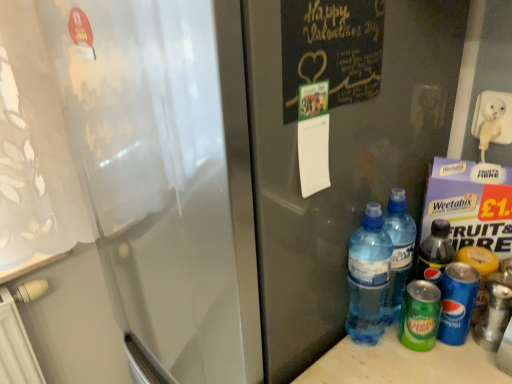
Where is `blue plastic bottle at lower right, which is counted as the 3th bottle, starting from the left`? The height and width of the screenshot is (384, 512). blue plastic bottle at lower right, which is counted as the 3th bottle, starting from the left is located at coordinates (457, 302).

Locate an element on the screen. The image size is (512, 384). black chalkboard at upper right is located at coordinates (331, 50).

This screenshot has width=512, height=384. I want to click on green matte can at lower right, the second bottle in the left-to-right sequence, so click(x=420, y=315).

Find the location of a particular element. The image size is (512, 384). blue plastic bottle at lower right, placed as the 1th bottle when sorted from right to left is located at coordinates (457, 302).

Based on the photo, which of these two, black chalkboard at upper right or green matte can at lower right, the 2th bottle in the right-to-left sequence, stands shorter?

green matte can at lower right, the 2th bottle in the right-to-left sequence, is shorter.

Considering the relative sizes of black chalkboard at upper right and green matte can at lower right, the 2th bottle in the right-to-left sequence, in the image provided, is black chalkboard at upper right smaller than green matte can at lower right, the 2th bottle in the right-to-left sequence,?

Yes, black chalkboard at upper right is smaller than green matte can at lower right, the 2th bottle in the right-to-left sequence.

Considering the positions of point (350, 84) and point (413, 281), is point (350, 84) closer or farther from the camera than point (413, 281)?

Point (350, 84).

Do you think black chalkboard at upper right is within green matte can at lower right, the second bottle in the left-to-right sequence, or outside of it?

black chalkboard at upper right cannot be found inside green matte can at lower right, the second bottle in the left-to-right sequence.

The height and width of the screenshot is (384, 512). Identify the location of bulletin board lying on the left of green matte can at lower right, the 2th bottle in the right-to-left sequence. (331, 50).

Is green matte can at lower right, the 2th bottle in the right-to-left sequence, further to camera compared to black chalkboard at upper right?

That is True.

Which object is thinner, green matte can at lower right, the 2th bottle in the right-to-left sequence, or black chalkboard at upper right?

black chalkboard at upper right.

From the image's perspective, between green matte can at lower right, the 2th bottle in the right-to-left sequence, and black chalkboard at upper right, who is located below?

From the image's view, green matte can at lower right, the 2th bottle in the right-to-left sequence, is below.

Is translucent plastic water bottles at lower right, the third bottle in the right-to-left sequence, to the left or to the right of green matte can at lower right, the second bottle in the left-to-right sequence, in the image?

From the image, it's evident that translucent plastic water bottles at lower right, the third bottle in the right-to-left sequence, is to the left of green matte can at lower right, the second bottle in the left-to-right sequence.

In the image, is translucent plastic water bottles at lower right, the first bottle when ordered from left to right, positioned in front of or behind green matte can at lower right, the second bottle in the left-to-right sequence?

translucent plastic water bottles at lower right, the first bottle when ordered from left to right, is positioned closer to the viewer than green matte can at lower right, the second bottle in the left-to-right sequence.

How far apart are translucent plastic water bottles at lower right, the third bottle in the right-to-left sequence, and green matte can at lower right, the 2th bottle in the right-to-left sequence?

They are 8.38 centimeters apart.

Can you tell me how much translucent plastic water bottles at lower right, the first bottle when ordered from left to right, and green matte can at lower right, the second bottle in the left-to-right sequence, differ in facing direction?

They differ by 0.00971 degrees in their facing directions.

Considering the sizes of objects black chalkboard at upper right and blue plastic bottle at lower right, placed as the 1th bottle when sorted from right to left, in the image provided, who is taller, black chalkboard at upper right or blue plastic bottle at lower right, placed as the 1th bottle when sorted from right to left,?

With more height is blue plastic bottle at lower right, placed as the 1th bottle when sorted from right to left.

Is black chalkboard at upper right further to camera compared to blue plastic bottle at lower right, placed as the 1th bottle when sorted from right to left?

No, black chalkboard at upper right is in front of blue plastic bottle at lower right, placed as the 1th bottle when sorted from right to left.

Which of these two, black chalkboard at upper right or blue plastic bottle at lower right, placed as the 1th bottle when sorted from right to left, is thinner?

With smaller width is black chalkboard at upper right.

Measure the distance from black chalkboard at upper right to blue plastic bottle at lower right, which is counted as the 3th bottle, starting from the left.

The distance of black chalkboard at upper right from blue plastic bottle at lower right, which is counted as the 3th bottle, starting from the left, is 42.32 centimeters.

From the image's perspective, does green matte can at lower right, the second bottle in the left-to-right sequence, appear higher than translucent plastic water bottles at lower right, the first bottle when ordered from left to right?

No.

Between green matte can at lower right, the 2th bottle in the right-to-left sequence, and translucent plastic water bottles at lower right, the first bottle when ordered from left to right, which one appears on the left side from the viewer's perspective?

translucent plastic water bottles at lower right, the first bottle when ordered from left to right.

Which point is more forward, (420, 338) or (375, 333)?

Positioned in front is point (420, 338).

In terms of width, does green matte can at lower right, the second bottle in the left-to-right sequence, look wider or thinner when compared to translucent plastic water bottles at lower right, the first bottle when ordered from left to right?

Considering their sizes, green matte can at lower right, the second bottle in the left-to-right sequence, looks slimmer than translucent plastic water bottles at lower right, the first bottle when ordered from left to right.

Choose the correct answer: Is green matte can at lower right, the second bottle in the left-to-right sequence, inside blue plastic bottle at lower right, which is counted as the 3th bottle, starting from the left, or outside it?

green matte can at lower right, the second bottle in the left-to-right sequence, cannot be found inside blue plastic bottle at lower right, which is counted as the 3th bottle, starting from the left.

Are green matte can at lower right, the second bottle in the left-to-right sequence, and blue plastic bottle at lower right, which is counted as the 3th bottle, starting from the left, making contact?

Indeed, green matte can at lower right, the second bottle in the left-to-right sequence, and blue plastic bottle at lower right, which is counted as the 3th bottle, starting from the left, are beside each other and touching.

Measure the distance from green matte can at lower right, the 2th bottle in the right-to-left sequence, to blue plastic bottle at lower right, placed as the 1th bottle when sorted from right to left.

3.75 centimeters.

Between green matte can at lower right, the second bottle in the left-to-right sequence, and blue plastic bottle at lower right, placed as the 1th bottle when sorted from right to left, which one is positioned behind?

green matte can at lower right, the second bottle in the left-to-right sequence.

Does point (377, 338) come farther from viewer compared to point (452, 336)?

Yes, it is behind point (452, 336).

Which object is further away from the camera, translucent plastic water bottles at lower right, the third bottle in the right-to-left sequence, or blue plastic bottle at lower right, which is counted as the 3th bottle, starting from the left?

blue plastic bottle at lower right, which is counted as the 3th bottle, starting from the left, is behind.

Is translucent plastic water bottles at lower right, the first bottle when ordered from left to right, facing away from blue plastic bottle at lower right, which is counted as the 3th bottle, starting from the left?

That's not correct — translucent plastic water bottles at lower right, the first bottle when ordered from left to right, is not looking away from blue plastic bottle at lower right, which is counted as the 3th bottle, starting from the left.

Based on the photo, between translucent plastic water bottles at lower right, the first bottle when ordered from left to right, and blue plastic bottle at lower right, placed as the 1th bottle when sorted from right to left, which one has more height?

Standing taller between the two is translucent plastic water bottles at lower right, the first bottle when ordered from left to right.

From the image's perspective, count 3rd bottles downward from the black chalkboard at upper right and point to it. Please provide its 2D coordinates.

[(420, 315)]

Which bottle is the 2nd one when counting from the right side of the black chalkboard at upper right? Please provide its 2D coordinates.

[(420, 315)]

Looking at the image, which one is located further to green matte can at lower right, the second bottle in the left-to-right sequence, black chalkboard at upper right or blue plastic bottle at lower right, which is counted as the 3th bottle, starting from the left?

Among the two, black chalkboard at upper right is located further to green matte can at lower right, the second bottle in the left-to-right sequence.

Based on the photo, from the image, which object appears to be farther from green matte can at lower right, the 2th bottle in the right-to-left sequence, blue plastic bottle at lower right, placed as the 1th bottle when sorted from right to left, or black chalkboard at upper right?

black chalkboard at upper right is positioned further to the anchor green matte can at lower right, the 2th bottle in the right-to-left sequence.

When comparing their distances from translucent plastic water bottles at lower right, the third bottle in the right-to-left sequence, does green matte can at lower right, the 2th bottle in the right-to-left sequence, or blue plastic bottle at lower right, placed as the 1th bottle when sorted from right to left, seem further?

blue plastic bottle at lower right, placed as the 1th bottle when sorted from right to left, lies further to translucent plastic water bottles at lower right, the third bottle in the right-to-left sequence, than the other object.

When comparing their distances from black chalkboard at upper right, does translucent plastic water bottles at lower right, the third bottle in the right-to-left sequence, or blue plastic bottle at lower right, placed as the 1th bottle when sorted from right to left, seem further?

The object further to black chalkboard at upper right is blue plastic bottle at lower right, placed as the 1th bottle when sorted from right to left.

Estimate the real-world distances between objects in this image. Which object is further from blue plastic bottle at lower right, which is counted as the 3th bottle, starting from the left, translucent plastic water bottles at lower right, the first bottle when ordered from left to right, or green matte can at lower right, the 2th bottle in the right-to-left sequence?

translucent plastic water bottles at lower right, the first bottle when ordered from left to right.

Considering their positions, is blue plastic bottle at lower right, placed as the 1th bottle when sorted from right to left, positioned further to translucent plastic water bottles at lower right, the third bottle in the right-to-left sequence, than green matte can at lower right, the 2th bottle in the right-to-left sequence?

blue plastic bottle at lower right, placed as the 1th bottle when sorted from right to left.

When comparing their distances from blue plastic bottle at lower right, placed as the 1th bottle when sorted from right to left, does green matte can at lower right, the second bottle in the left-to-right sequence, or translucent plastic water bottles at lower right, the third bottle in the right-to-left sequence, seem further?

translucent plastic water bottles at lower right, the third bottle in the right-to-left sequence, is positioned further to the anchor blue plastic bottle at lower right, placed as the 1th bottle when sorted from right to left.

From the picture: Estimate the real-world distances between objects in this image. Which object is closer to translucent plastic water bottles at lower right, the third bottle in the right-to-left sequence, green matte can at lower right, the 2th bottle in the right-to-left sequence, or black chalkboard at upper right?

The object closer to translucent plastic water bottles at lower right, the third bottle in the right-to-left sequence, is green matte can at lower right, the 2th bottle in the right-to-left sequence.

You are a GUI agent. You are given a task and a screenshot of the screen. Output one action in this format:
    pyautogui.click(x=<x>, y=<y>)
    Task: Click on the bottle situated between translucent plastic water bottles at lower right, the third bottle in the right-to-left sequence, and blue plastic bottle at lower right, placed as the 1th bottle when sorted from right to left, from left to right
    This screenshot has height=384, width=512.
    Given the screenshot: What is the action you would take?
    pyautogui.click(x=420, y=315)

Locate an element on the screen. The image size is (512, 384). bottle that lies between black chalkboard at upper right and blue plastic bottle at lower right, placed as the 1th bottle when sorted from right to left, from top to bottom is located at coordinates (368, 277).